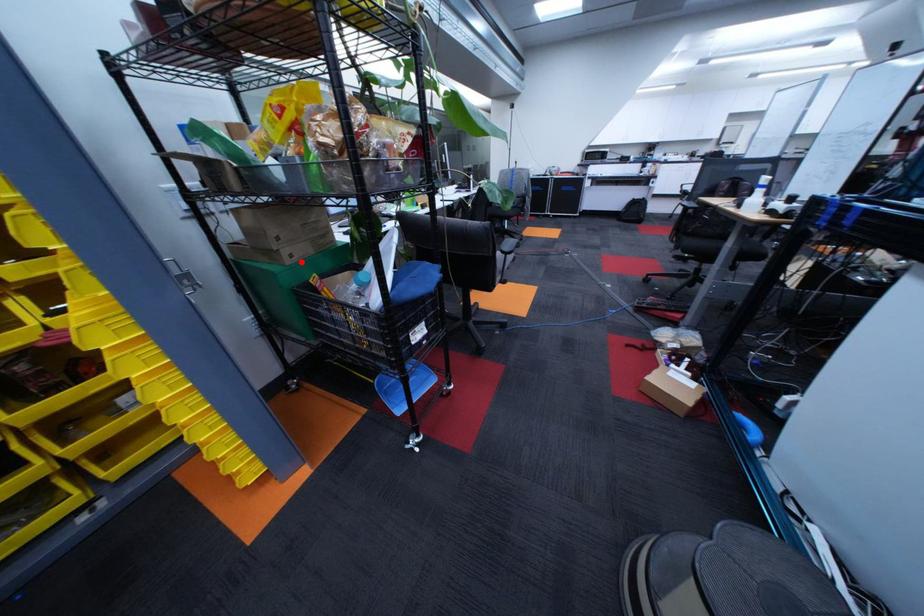
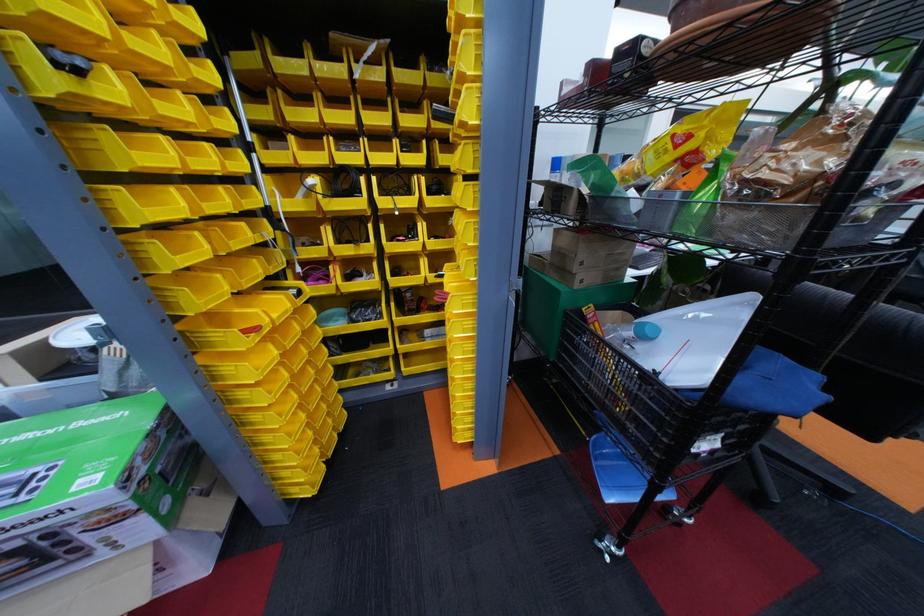
Locate, in the second image, the point that corresponds to the highlighted location in the first image.

(590, 286)